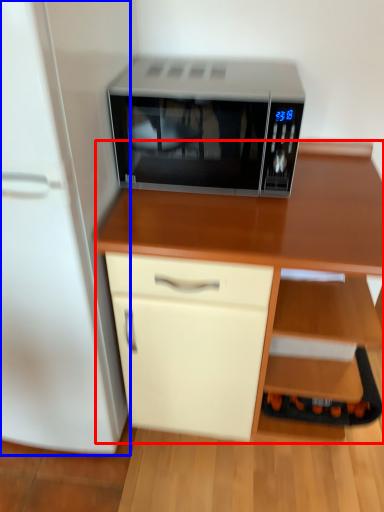
Question: Which object appears farthest to the camera in this image, desk (highlighted by a red box) or refrigerator (highlighted by a blue box)?

Choices:
 (A) desk
 (B) refrigerator

Answer: (A)